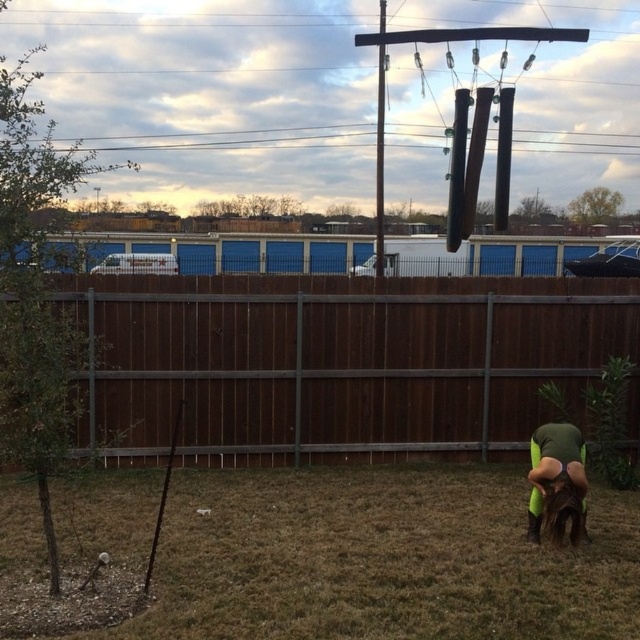
Question: Where is green fabric at lower right located in relation to black wood pole at upper center in the image?

Choices:
 (A) above
 (B) below

Answer: (B)

Question: Is brown wood fence at center behind brown furry dog at lower right?

Choices:
 (A) yes
 (B) no

Answer: (A)

Question: Can you confirm if brown wood fence at center is thinner than brown dry grass at lower center?

Choices:
 (A) no
 (B) yes

Answer: (A)

Question: Which point appears farthest from the camera in this image?

Choices:
 (A) tap(572, 540)
 (B) tap(538, 452)
 (C) tap(412, 509)

Answer: (C)

Question: Among these points, which one is nearest to the camera?

Choices:
 (A) (500, 577)
 (B) (545, 531)
 (C) (531, 477)

Answer: (A)

Question: Which of the following is the closest to the observer?

Choices:
 (A) (579, 506)
 (B) (568, 513)
 (C) (380, 134)

Answer: (A)